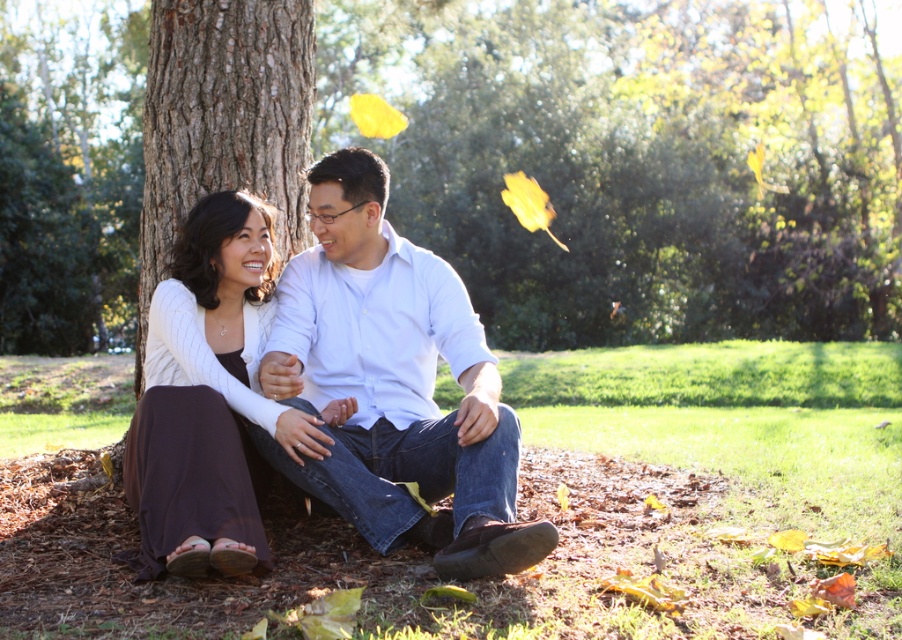
Question: Does brown denim jeans at center lie behind white cotton shirt at center?

Choices:
 (A) yes
 (B) no

Answer: (B)

Question: From the image, what is the correct spatial relationship of brown denim jeans at center in relation to white cotton shirt at center?

Choices:
 (A) below
 (B) above

Answer: (A)

Question: Which object is farther from the camera taking this photo?

Choices:
 (A) brown denim jeans at center
 (B) matte white sweater at center
 (C) brown textured bark at center
 (D) white cotton shirt at center

Answer: (C)

Question: Does brown denim jeans at center appear on the left side of matte white sweater at center?

Choices:
 (A) no
 (B) yes

Answer: (A)

Question: Which point is farther to the camera?

Choices:
 (A) brown denim jeans at center
 (B) brown textured bark at center
 (C) matte white sweater at center

Answer: (B)

Question: Estimate the real-world distances between objects in this image. Which object is closer to the white cotton shirt at center?

Choices:
 (A) brown denim jeans at center
 (B) matte white sweater at center
 (C) brown textured bark at center

Answer: (B)